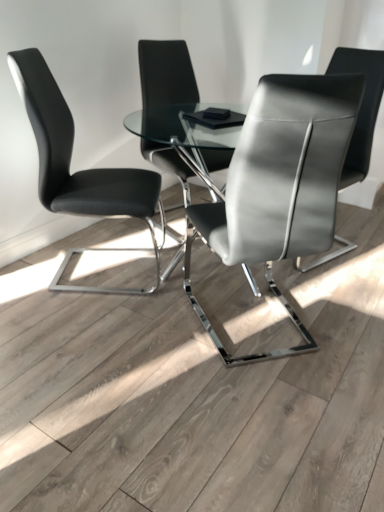
The height and width of the screenshot is (512, 384). In order to click on vacant region under satin gray leather chair at center, marked as the second chair in a right-to-left arrangement (from a real-world perspective) in this screenshot , I will do `click(254, 330)`.